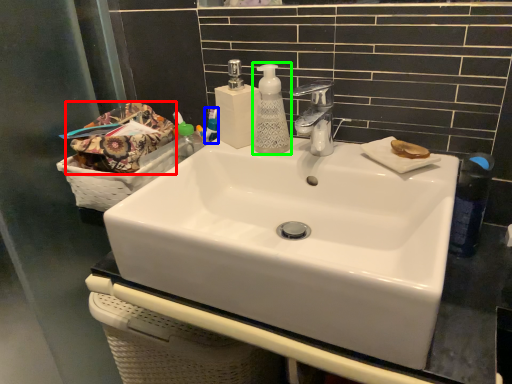
Question: Which object is positioned farthest from material (highlighted by a red box)? Select from mouthwash (highlighted by a blue box) and soap dispenser (highlighted by a green box).

Choices:
 (A) mouthwash
 (B) soap dispenser

Answer: (B)